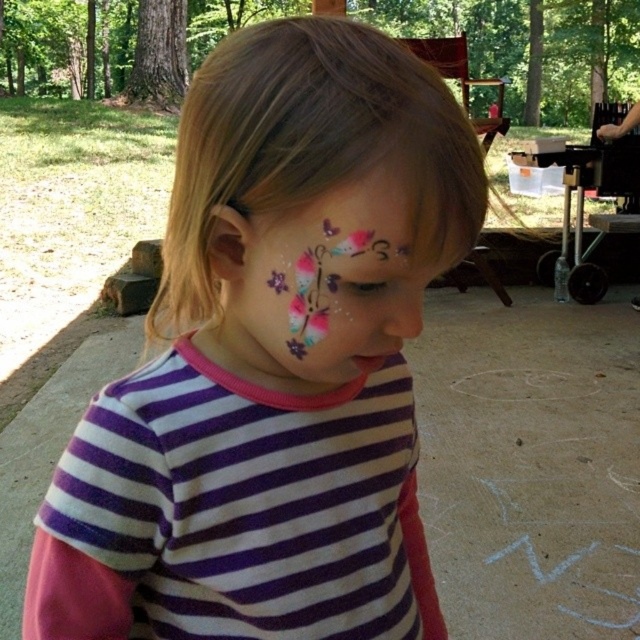
Question: Can you confirm if matte white face paint at center is wider than pastel glitter butterflies at center?

Choices:
 (A) yes
 (B) no

Answer: (A)

Question: Does matte white face paint at center appear under pastel glitter butterflies at center?

Choices:
 (A) no
 (B) yes

Answer: (B)

Question: Which point appears closest to the camera in this image?

Choices:
 (A) (419, 314)
 (B) (244, 312)
 (C) (339, 332)

Answer: (C)

Question: Which of the following is the farthest from the observer?

Choices:
 (A) (381, 272)
 (B) (248, 632)
 (C) (392, 291)

Answer: (B)

Question: Which object is the closest to the matte white face paint at center?

Choices:
 (A) pastel glitter butterflies at center
 (B) matte pink nose at center

Answer: (A)

Question: Considering the relative positions of matte white face paint at center and pastel glitter butterflies at center in the image provided, where is matte white face paint at center located with respect to pastel glitter butterflies at center?

Choices:
 (A) right
 (B) left

Answer: (B)